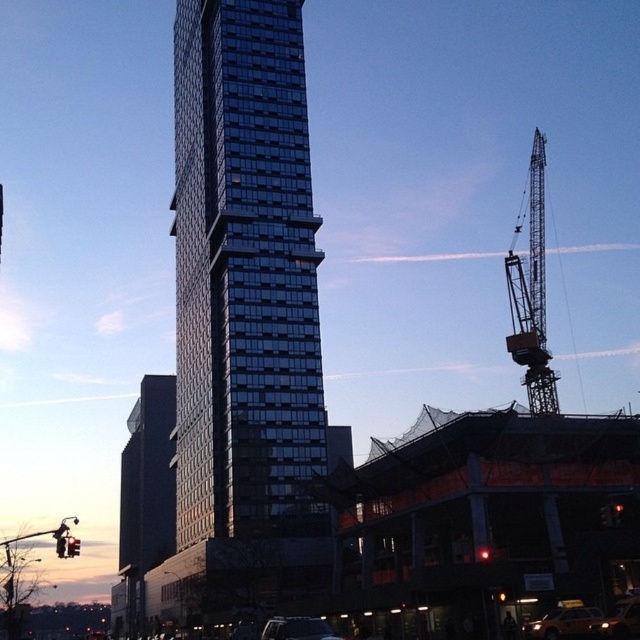
You are standing in an urban area and want to take a photo of the glassy reflective skyscraper at center. If your camera has a maximum focus range of 80 meters, will it be able to capture the skyscraper clearly?

The glassy reflective skyscraper at center is 80.96 meters away from viewer. Since the camera can only focus up to 80 meters, it won not be able to capture the skyscraper clearly.